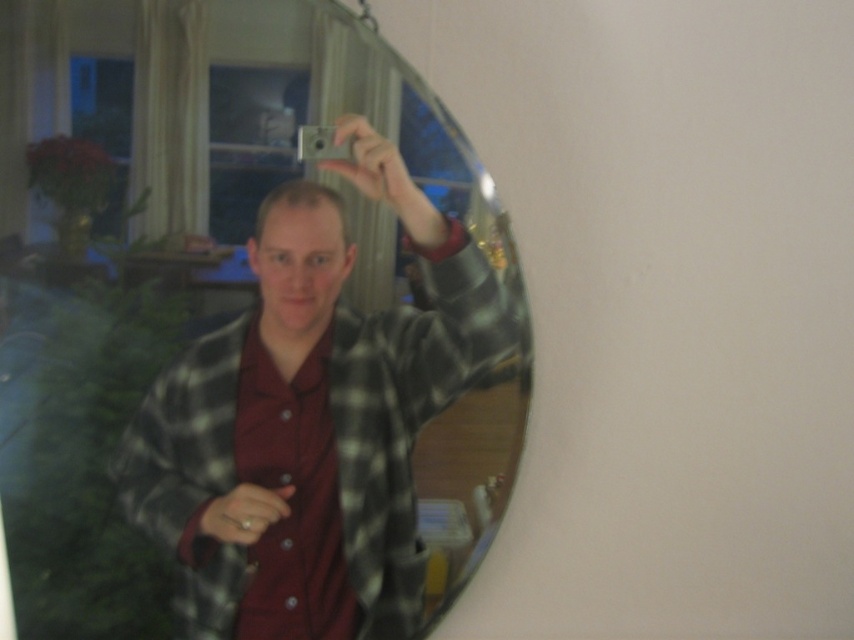
Is plaid flannel shirt at center positioned behind maroon button-up shirt at center?

No.

In the scene shown: Does plaid flannel shirt at center appear over maroon button-up shirt at center?

Yes.

Is point (281, 595) positioned in front of point (258, 627)?

Yes, point (281, 595) is in front of point (258, 627).

You are a GUI agent. You are given a task and a screenshot of the screen. Output one action in this format:
    pyautogui.click(x=<x>, y=<y>)
    Task: Click on the plaid flannel shirt at center
    The image size is (854, 640).
    Given the screenshot: What is the action you would take?
    pyautogui.click(x=313, y=419)